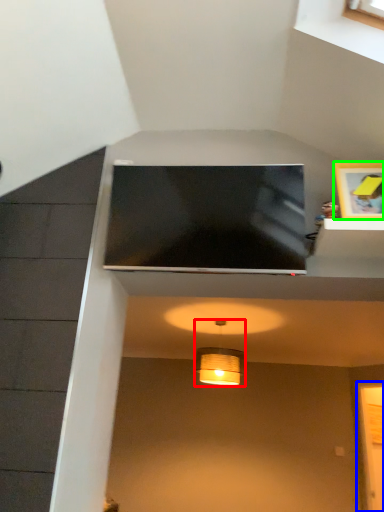
Question: Which object is positioned closest to lamp (highlighted by a red box)? Select from glass door (highlighted by a blue box) and picture frame (highlighted by a green box).

Choices:
 (A) glass door
 (B) picture frame

Answer: (A)